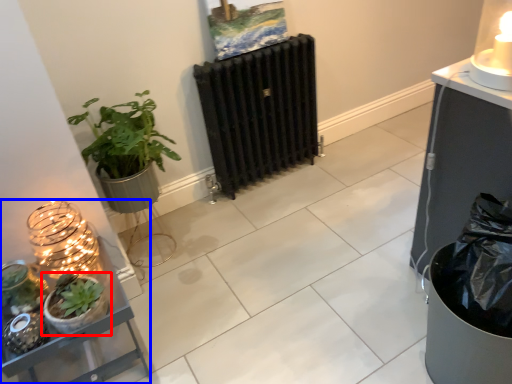
Question: Among these objects, which one is farthest to the camera, houseplant (highlighted by a red box) or shelf (highlighted by a blue box)?

Choices:
 (A) houseplant
 (B) shelf

Answer: (A)